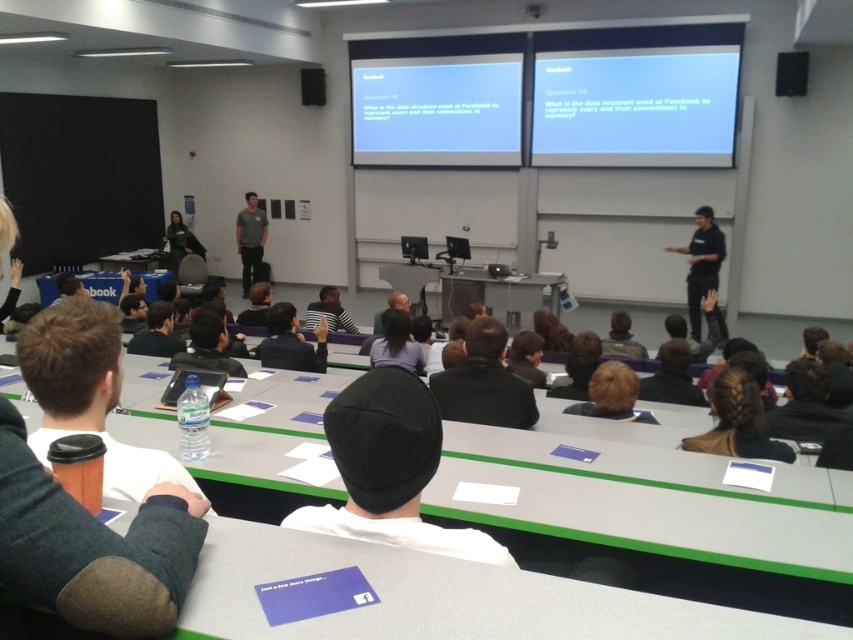
Question: Is white plastic table at center to the right of white matte projection screen at upper center from the viewer's perspective?

Choices:
 (A) no
 (B) yes

Answer: (A)

Question: Does brown paper cup at lower left appear over black leather jacket at center?

Choices:
 (A) yes
 (B) no

Answer: (A)

Question: Among these objects, which one is farthest from the camera?

Choices:
 (A) white matte projector screen at upper center
 (B) matte plastic table at center

Answer: (A)

Question: Which point is farther to the camera?

Choices:
 (A) (624, 534)
 (B) (244, 221)
 (C) (119, 449)

Answer: (B)

Question: Which is farther from the white matte projector screen at upper center?

Choices:
 (A) matte plastic table at center
 (B) black hair at center
 (C) matte gray shirt at center

Answer: (B)

Question: Can you confirm if white plastic table at center is positioned below white matte projection screen at upper center?

Choices:
 (A) no
 (B) yes

Answer: (B)